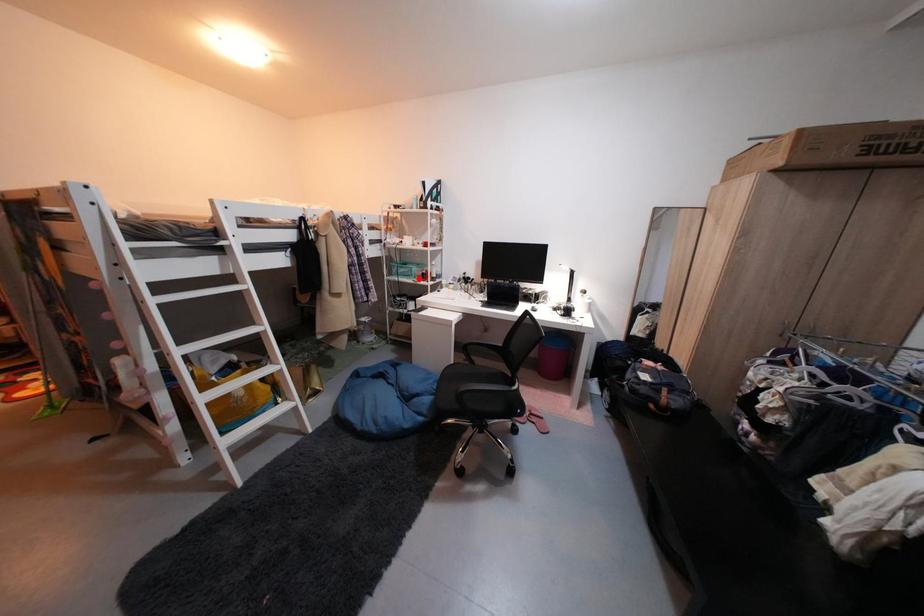
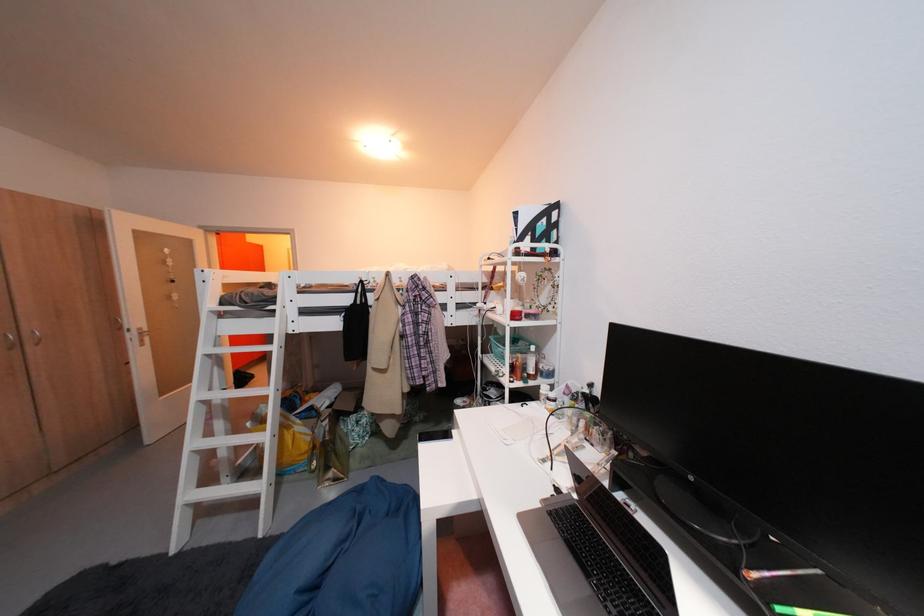
Question: I am providing you with two images of the same scene from different viewpoints. A red point is marked on the first image. Is the red point's position out of view in image 2?

Choices:
 (A) Yes
 (B) No

Answer: (B)